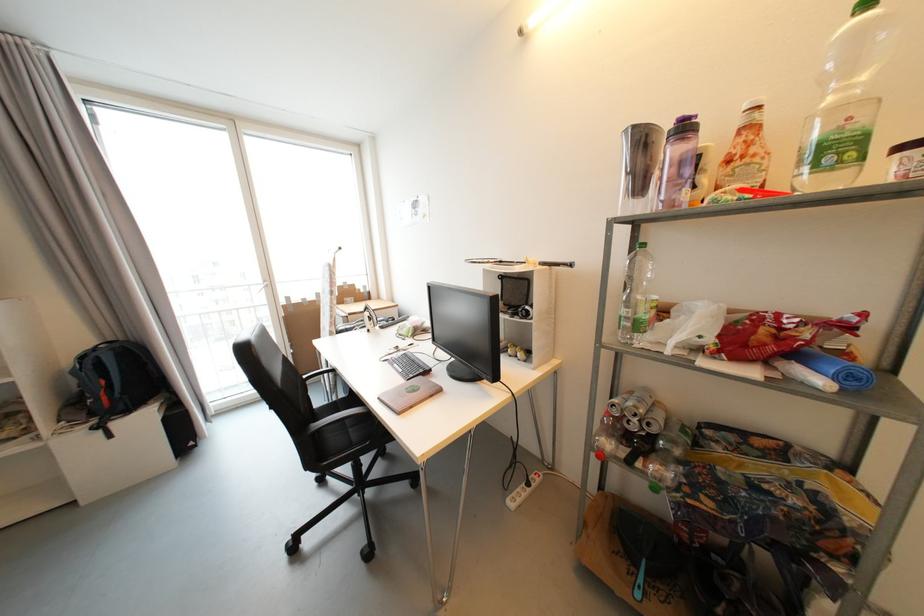
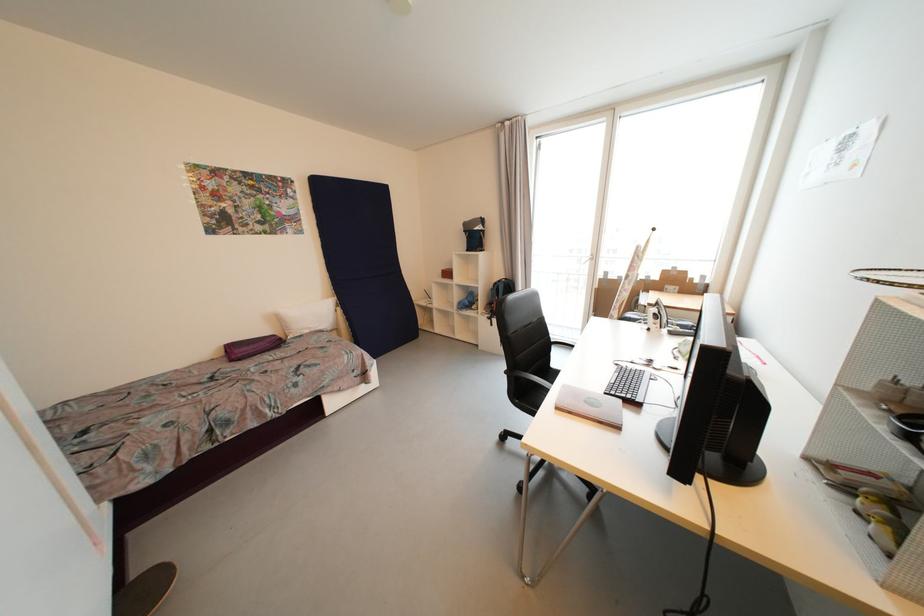
In the second image, find the point that corresponds to point 375,320 in the first image.

(662, 318)